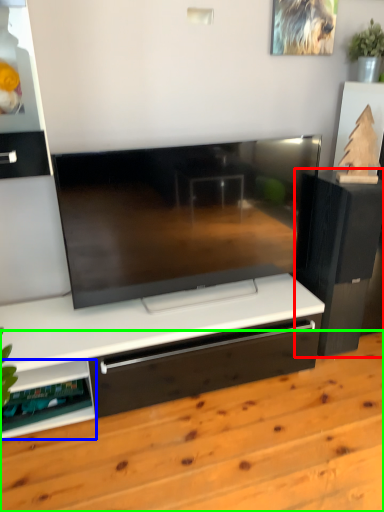
Question: Which object is the closest to the furniture (highlighted by a red box)? Choose among these: shelf (highlighted by a blue box) or hardwood (highlighted by a green box).

Choices:
 (A) shelf
 (B) hardwood

Answer: (B)